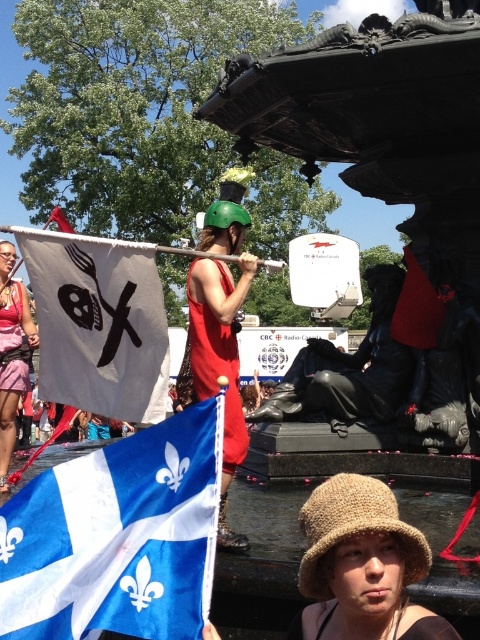
You are a photographer trying to capture both the matte red tank top at center and the pink fabric dress at left in the same frame. Given their sizes, which one would you need to position closer to the camera to ensure both appear equally sized in the photo?

The matte red tank top at center is bigger than the pink fabric dress at left, so you would need to move the pink fabric dress at left closer to the camera to make them appear the same size in the photo.

What is the exact coordinate of the blue fabric flag at lower left?

The blue fabric flag at lower left is located at point (117, 536).

You are standing at the event and want to hand a leaflet to the person holding the blue fabric flag at lower left. Considering the distance, can you comfortably walk up to them without needing to run? Please state the distance from you to them.

The blue fabric flag at lower left is 15.88 meters from viewer. Since 15.88 meters is a reasonable walking distance, you can comfortably walk up to them without needing to run.